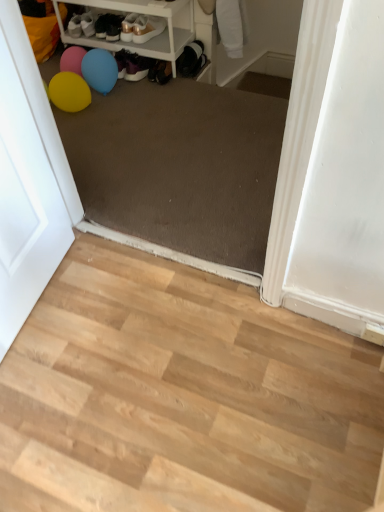
Question: Are light wood floor at lower left and matte white screen door at left making contact?

Choices:
 (A) yes
 (B) no

Answer: (B)

Question: From a real-world perspective, does light wood floor at lower left stand above matte white screen door at left?

Choices:
 (A) no
 (B) yes

Answer: (A)

Question: Is light wood floor at lower left wider than matte white screen door at left?

Choices:
 (A) yes
 (B) no

Answer: (A)

Question: Can you confirm if light wood floor at lower left is smaller than matte white screen door at left?

Choices:
 (A) no
 (B) yes

Answer: (A)

Question: From a real-world perspective, is light wood floor at lower left beneath matte white screen door at left?

Choices:
 (A) no
 (B) yes

Answer: (B)

Question: Can you confirm if light wood floor at lower left is taller than matte white screen door at left?

Choices:
 (A) no
 (B) yes

Answer: (A)

Question: Is matte white sneakers at upper center, the first footwear viewed from the right, to the left of matte black shoes at upper center, the 3th footwear positioned from the right, from the viewer's perspective?

Choices:
 (A) no
 (B) yes

Answer: (A)

Question: Is matte white sneakers at upper center, the first footwear viewed from the right, not near matte black shoes at upper center, the 3th footwear positioned from the right?

Choices:
 (A) no
 (B) yes

Answer: (A)

Question: Can you confirm if matte white sneakers at upper center, the first footwear viewed from the right, is bigger than matte black shoes at upper center, which ranks as the 1th footwear in left-to-right order?

Choices:
 (A) no
 (B) yes

Answer: (B)

Question: Is matte white sneakers at upper center, the third footwear from the left, located outside matte black shoes at upper center, the 3th footwear positioned from the right?

Choices:
 (A) yes
 (B) no

Answer: (A)

Question: Could you tell me if matte white sneakers at upper center, the third footwear from the left, is facing matte black shoes at upper center, the 3th footwear positioned from the right?

Choices:
 (A) no
 (B) yes

Answer: (A)

Question: Can you confirm if matte white sneakers at upper center, the first footwear viewed from the right, is taller than matte black shoes at upper center, which ranks as the 1th footwear in left-to-right order?

Choices:
 (A) no
 (B) yes

Answer: (B)

Question: From the image's perspective, is white plastic shelf at upper left below light wood floor at lower left?

Choices:
 (A) yes
 (B) no

Answer: (B)